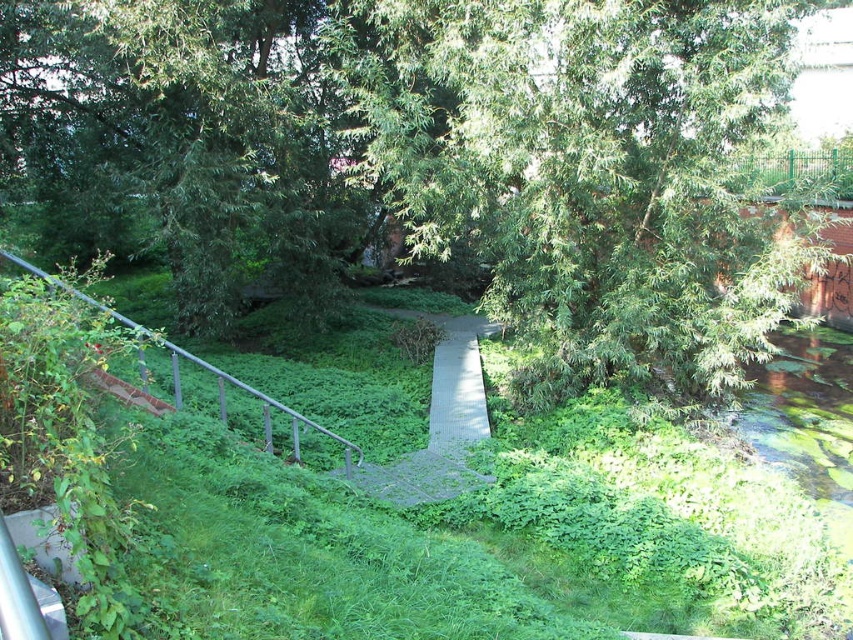
Does green leafy grass at center have a greater width compared to silver metallic rail at lower left?

Yes, green leafy grass at center is wider than silver metallic rail at lower left.

Is point (399, 538) in front of point (120, 320)?

Yes, it is in front of point (120, 320).

You are a GUI agent. You are given a task and a screenshot of the screen. Output one action in this format:
    pyautogui.click(x=<x>, y=<y>)
    Task: Click on the green leafy grass at center
    This screenshot has height=640, width=853.
    Given the screenshot: What is the action you would take?
    pyautogui.click(x=469, y=540)

Is green leafy tree at center to the right of silver metallic rail at lower left from the viewer's perspective?

Yes, green leafy tree at center is to the right of silver metallic rail at lower left.

Who is lower down, green leafy tree at center or silver metallic rail at lower left?

silver metallic rail at lower left

Is point (570, 381) less distant than point (32, 273)?

No, (570, 381) is further to viewer.

Identify the location of green leafy tree at center. (438, 157).

Can you confirm if green leafy tree at center is positioned to the right of gray textured boardwalk at center?

No, green leafy tree at center is not to the right of gray textured boardwalk at center.

This screenshot has width=853, height=640. What are the coordinates of `green leafy tree at center` in the screenshot? It's located at (438, 157).

This screenshot has height=640, width=853. Find the location of `green leafy tree at center`. green leafy tree at center is located at coordinates (438, 157).